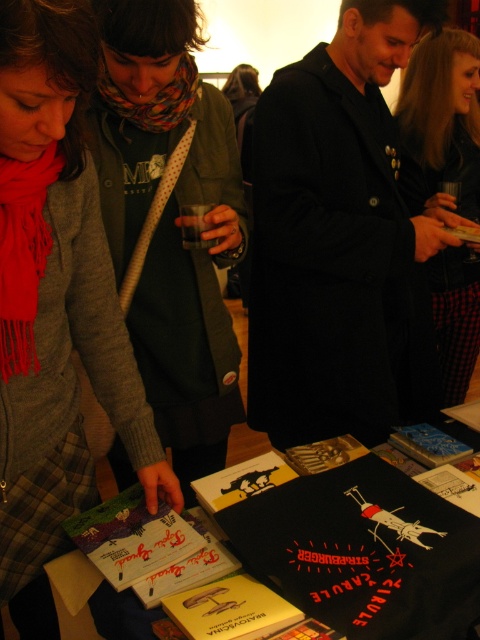
Please use the coordinates provided to determine the exact position of the multicolored scarf at center. What are its coordinates?

The multicolored scarf at center is located at coordinates (169,221).

You are standing at the entrance of the book fair and see the scene described. There is a specific point of interest marked at coordinates point (54, 301). What object at this coordinate is part of the woman in the gray cardigan and red scarf?

The point (54, 301) corresponds to the matte gray scarf at lower left, which is part of the woman in the gray cardigan and red scarf.

You are a vendor at the book fair and need to retrieve the red silk scarf at left from under the black leather jacket at upper right. Is the jacket currently covering the scarf?

The black leather jacket at upper right is positioned over the red silk scarf at left, so yes, the jacket is currently covering the scarf.